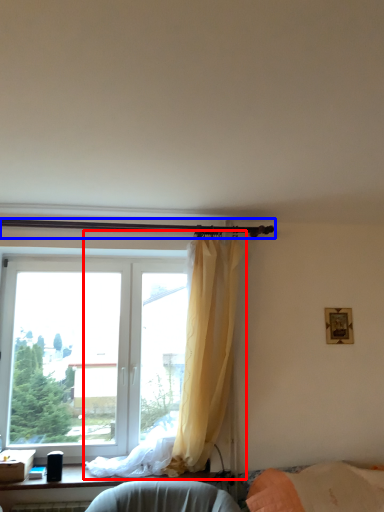
Question: Which object appears closest to the camera in this image, curtain (highlighted by a red box) or beam (highlighted by a blue box)?

Choices:
 (A) curtain
 (B) beam

Answer: (A)